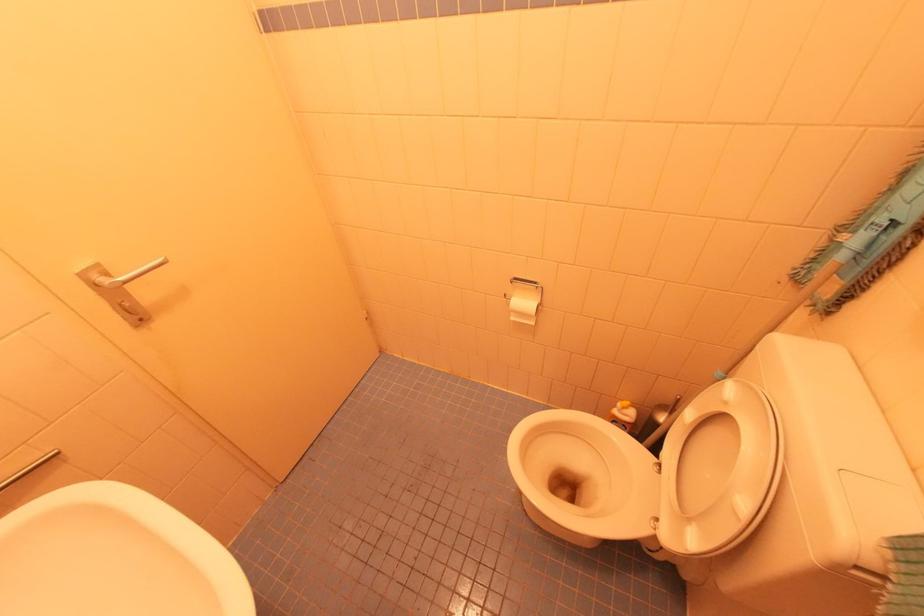
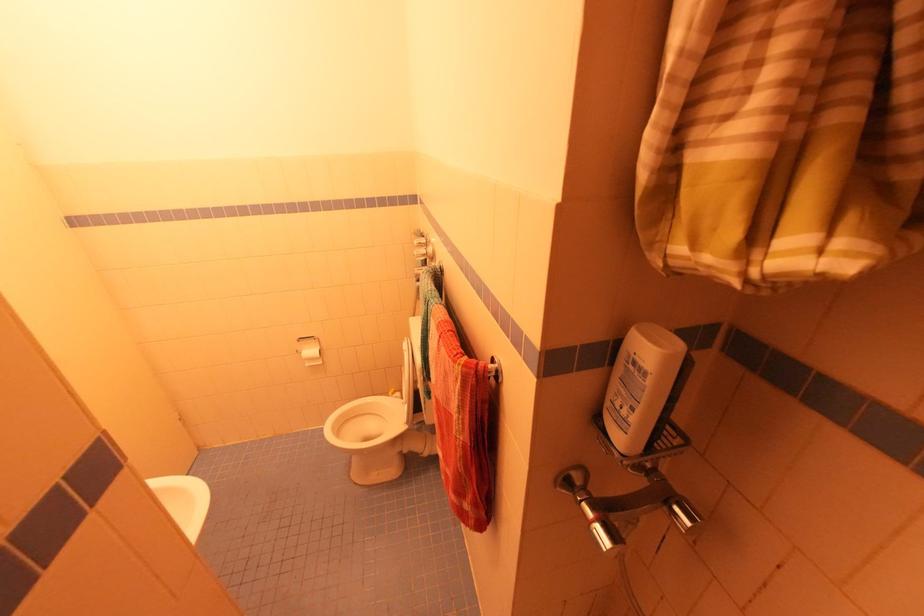
In the second image, find the point that corresponds to point 537,284 in the first image.

(314, 338)